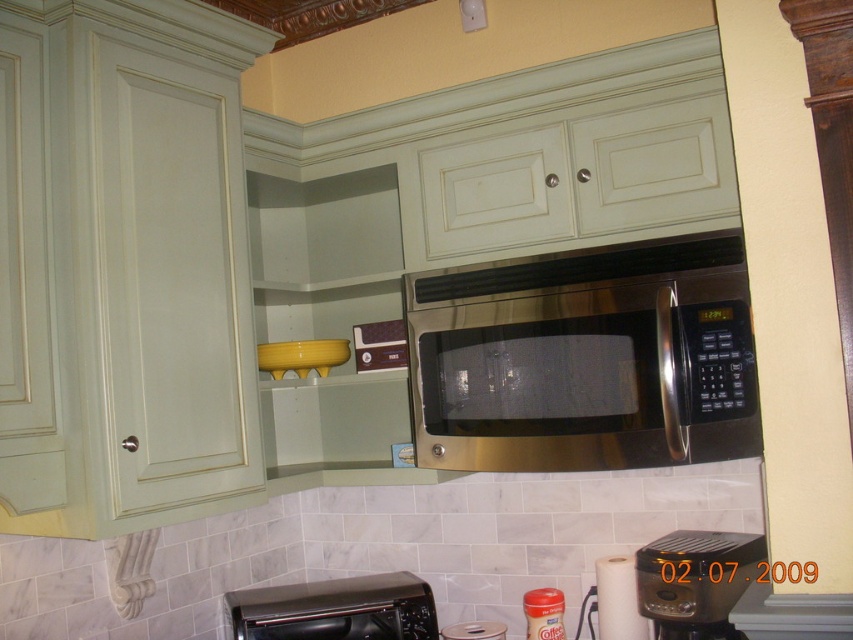
Question: Where is black plastic toaster oven at lower center located in relation to black plastic coffee maker at lower center in the image?

Choices:
 (A) right
 (B) left

Answer: (B)

Question: Does stainless steel microwave at center have a greater width compared to black plastic toaster oven at lower center?

Choices:
 (A) yes
 (B) no

Answer: (A)

Question: Is stainless steel microwave at center above black plastic coffee maker at lower center?

Choices:
 (A) yes
 (B) no

Answer: (A)

Question: Which of the following is the closest to the observer?

Choices:
 (A) stainless steel microwave at center
 (B) black plastic coffee maker at lower center

Answer: (A)

Question: Which of the following is the closest to the observer?

Choices:
 (A) tap(625, 243)
 (B) tap(289, 586)

Answer: (A)

Question: Which object is farther from the camera taking this photo?

Choices:
 (A) black plastic toaster oven at lower center
 (B) stainless steel microwave at center

Answer: (A)